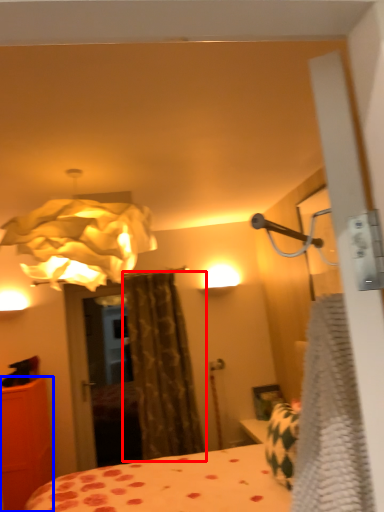
Question: Which object appears farthest to the camera in this image, curtain (highlighted by a red box) or furniture (highlighted by a blue box)?

Choices:
 (A) curtain
 (B) furniture

Answer: (A)